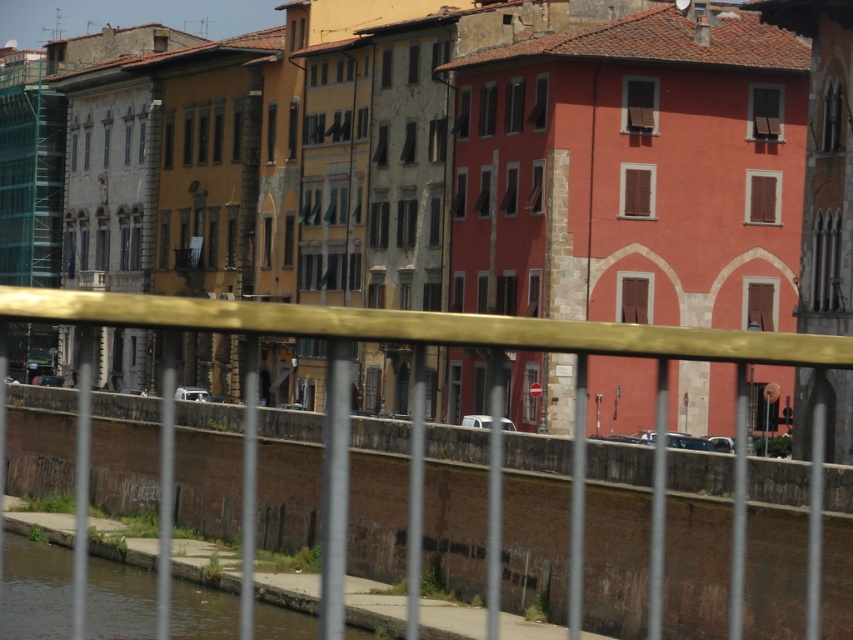
Question: Does gold metallic fence at center have a lesser width compared to brown concrete river at lower left?

Choices:
 (A) no
 (B) yes

Answer: (A)

Question: Can you confirm if gold metallic fence at center is positioned to the right of brown concrete river at lower left?

Choices:
 (A) yes
 (B) no

Answer: (A)

Question: Which object is closer to the camera taking this photo?

Choices:
 (A) brown concrete river at lower left
 (B) gold metallic fence at center

Answer: (B)

Question: Can you confirm if gold metallic fence at center is thinner than brown concrete river at lower left?

Choices:
 (A) no
 (B) yes

Answer: (A)